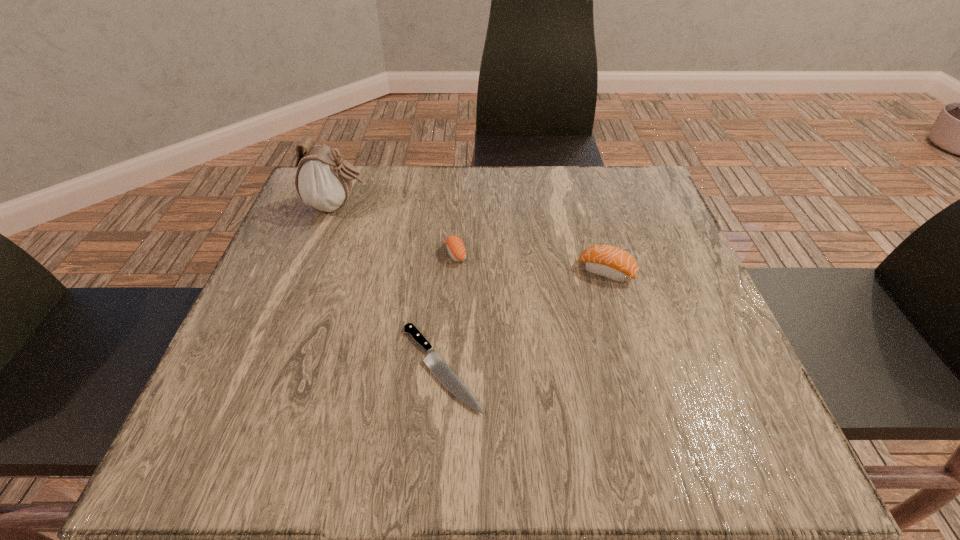
This screenshot has width=960, height=540. What are the coordinates of `pouch` in the screenshot? It's located at (323, 180).

Where is `the leftmost object`? The image size is (960, 540). the leftmost object is located at coordinates (323, 180).

The image size is (960, 540). In order to click on the right sushi in this screenshot , I will do `click(607, 261)`.

Find the location of `the rightmost object`. the rightmost object is located at coordinates (607, 261).

Locate an element on the screen. This screenshot has height=540, width=960. the left sushi is located at coordinates (456, 249).

The height and width of the screenshot is (540, 960). What are the coordinates of `the shorter sushi` in the screenshot? It's located at (456, 249).

The width and height of the screenshot is (960, 540). I want to click on the shortest object, so tap(432, 360).

Identify the location of the nearest object. Image resolution: width=960 pixels, height=540 pixels. (432, 360).

This screenshot has height=540, width=960. I want to click on free space located 0.270m on the front-facing side of the farthest object, so click(x=479, y=206).

At what (x,y) coordinates should I click in order to perform the action: click on free space located on the front of the rightmost object. Please return your answer as a coordinate pair (x, y). Looking at the image, I should click on (635, 375).